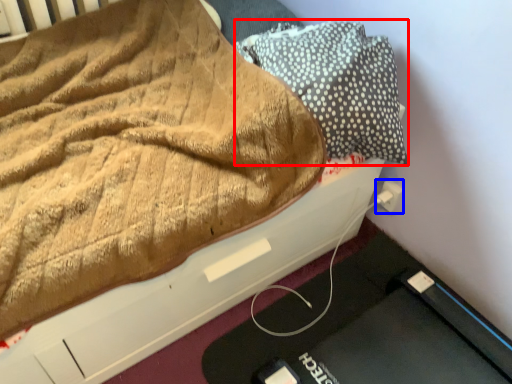
Question: Which object appears closest to the camera in this image, pillow (highlighted by a red box) or electric outlet (highlighted by a blue box)?

Choices:
 (A) pillow
 (B) electric outlet

Answer: (A)